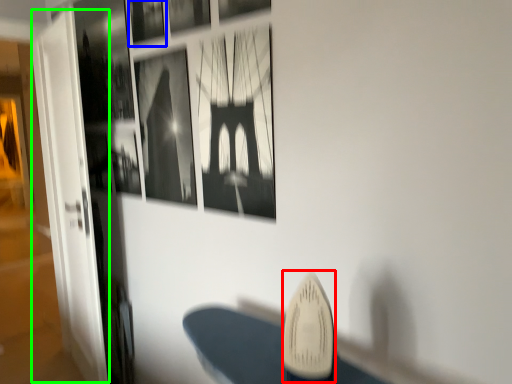
Question: Which object is positioned farthest from surfboard (highlighted by a red box)? Select from picture frame (highlighted by a blue box) and glass door (highlighted by a green box).

Choices:
 (A) picture frame
 (B) glass door

Answer: (B)